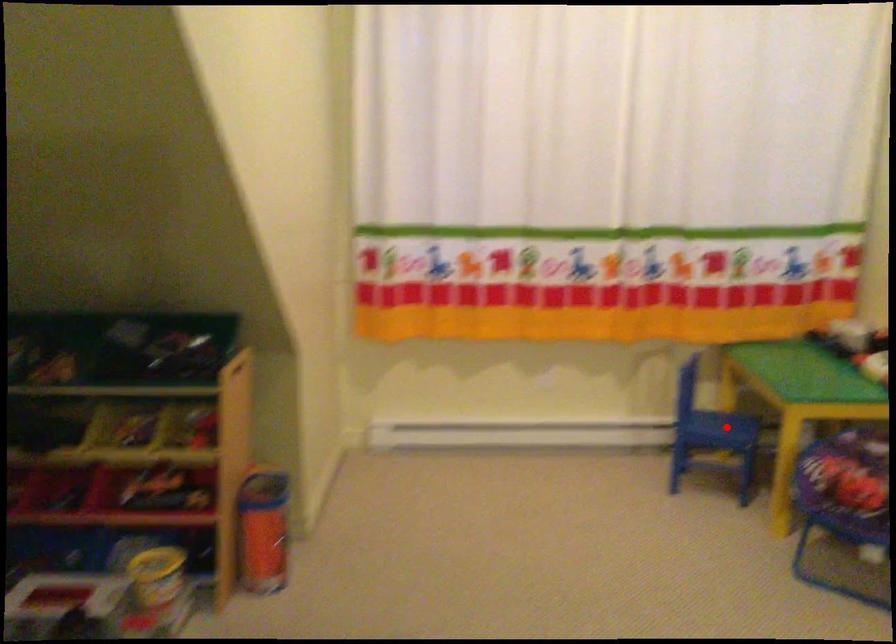
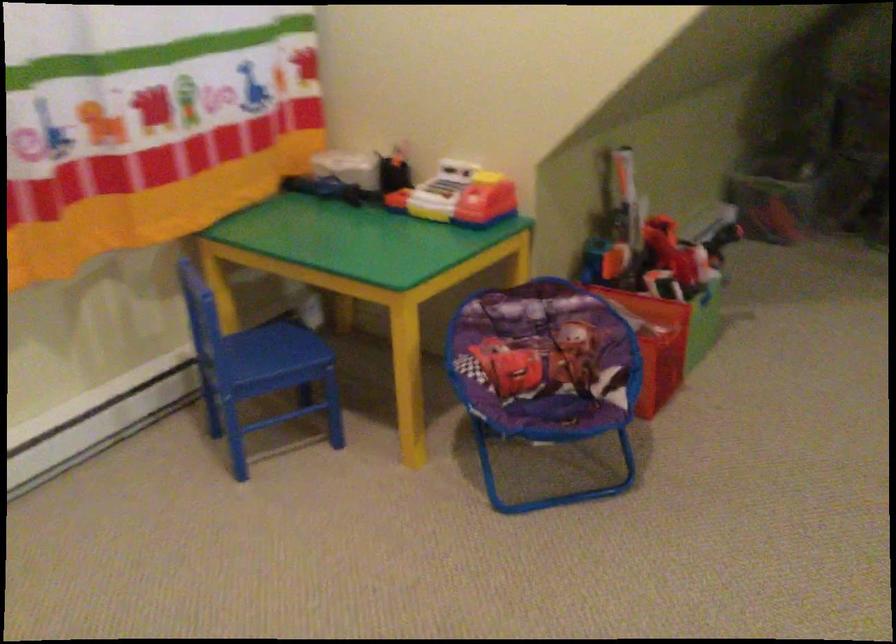
Question: I am providing you with two images of the same scene from different viewpoints. Image1 has a red point marked. In image2, the corresponding 3D location appears at what relative position? Reply with the corresponding letter.

Choices:
 (A) Closer
 (B) Farther

Answer: (A)